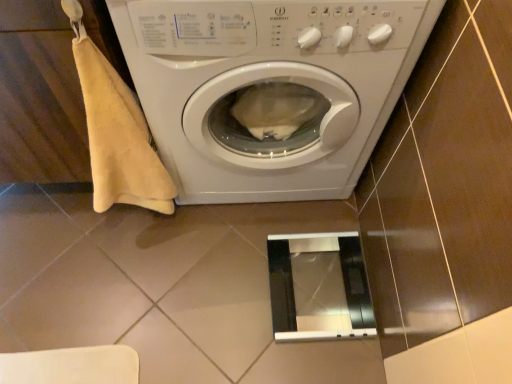
What do you see at coordinates (319, 287) in the screenshot?
I see `metallic silver screen door at lower center` at bounding box center [319, 287].

This screenshot has height=384, width=512. I want to click on metallic silver screen door at lower center, so click(319, 287).

Who is more distant, metallic silver screen door at lower center or white glossy washing machine at center?

metallic silver screen door at lower center is further from the camera.

Is white glossy washing machine at center inside metallic silver screen door at lower center?

Actually, white glossy washing machine at center is outside metallic silver screen door at lower center.

Between metallic silver screen door at lower center and white glossy washing machine at center, which one has smaller size?

metallic silver screen door at lower center.

Looking at their sizes, would you say metallic silver screen door at lower center is wider or thinner than white glossy washing machine at center?

Clearly, metallic silver screen door at lower center has less width compared to white glossy washing machine at center.

Could you tell me if metallic silver screen door at lower center is turned towards beige cotton towel at left?

No, metallic silver screen door at lower center is not facing towards beige cotton towel at left.

How far apart are metallic silver screen door at lower center and beige cotton towel at left?

21.45 inches.

How many degrees apart are the facing directions of metallic silver screen door at lower center and beige cotton towel at left?

There is a 0.22-degree angle between the facing directions of metallic silver screen door at lower center and beige cotton towel at left.

Are metallic silver screen door at lower center and beige cotton towel at left beside each other?

metallic silver screen door at lower center and beige cotton towel at left are not in contact.

Consider the image. Does white glossy washing machine at center have a lesser width compared to metallic silver screen door at lower center?

No.

Is white glossy washing machine at center bigger or smaller than metallic silver screen door at lower center?

Clearly, white glossy washing machine at center is larger in size than metallic silver screen door at lower center.

From the image's perspective, is white glossy washing machine at center beneath metallic silver screen door at lower center?

No, from the image's perspective, white glossy washing machine at center is not beneath metallic silver screen door at lower center.

Is point (420, 33) closer to viewer compared to point (278, 279)?

Yes, point (420, 33) is in front of point (278, 279).

How many degrees apart are the facing directions of white glossy washing machine at center and beige cotton towel at left?

1.44e-05 degrees.

Is white glossy washing machine at center at the left side of beige cotton towel at left?

No, white glossy washing machine at center is not to the left of beige cotton towel at left.

Who is more distant, white glossy washing machine at center or beige cotton towel at left?

white glossy washing machine at center is further away from the camera.

Is white glossy washing machine at center not near beige cotton towel at left?

No, there isn't a large distance between white glossy washing machine at center and beige cotton towel at left.

Between beige cotton towel at left and metallic silver screen door at lower center, which one has smaller width?

beige cotton towel at left.

Is beige cotton towel at left facing away from metallic silver screen door at lower center?

That's not correct — beige cotton towel at left is not looking away from metallic silver screen door at lower center.

How many degrees apart are the facing directions of beige cotton towel at left and white glossy washing machine at center?

There is a 1.44e-05-degree angle between the facing directions of beige cotton towel at left and white glossy washing machine at center.

Is beige cotton towel at left taller or shorter than white glossy washing machine at center?

Clearly, beige cotton towel at left is shorter compared to white glossy washing machine at center.

From a real-world perspective, is beige cotton towel at left physically above white glossy washing machine at center?

Indeed, from a real-world perspective, beige cotton towel at left stands above white glossy washing machine at center.

From the image's perspective, is beige cotton towel at left above white glossy washing machine at center?

Actually, beige cotton towel at left appears below white glossy washing machine at center in the image.

Locate an element on the screen. This screenshot has height=384, width=512. washing machine in front of the metallic silver screen door at lower center is located at coordinates (269, 89).

This screenshot has height=384, width=512. In the image, there is a beige cotton towel at left. In order to click on screen door below it (from the image's perspective) in this screenshot , I will do `click(319, 287)`.

Which object lies further to the anchor point beige cotton towel at left, white glossy washing machine at center or metallic silver screen door at lower center?

Based on the image, metallic silver screen door at lower center appears to be further to beige cotton towel at left.

From the image, which object appears to be nearer to metallic silver screen door at lower center, beige cotton towel at left or white glossy washing machine at center?

white glossy washing machine at center is closer to metallic silver screen door at lower center.

From the image, which object appears to be farther from white glossy washing machine at center, beige cotton towel at left or metallic silver screen door at lower center?

Among the two, metallic silver screen door at lower center is located further to white glossy washing machine at center.

Based on their spatial positions, is metallic silver screen door at lower center or beige cotton towel at left further from white glossy washing machine at center?

metallic silver screen door at lower center is positioned further to the anchor white glossy washing machine at center.

In the scene shown: From the image, which object appears to be nearer to metallic silver screen door at lower center, white glossy washing machine at center or beige cotton towel at left?

white glossy washing machine at center.

Which object lies further to the anchor point beige cotton towel at left, metallic silver screen door at lower center or white glossy washing machine at center?

metallic silver screen door at lower center lies further to beige cotton towel at left than the other object.

You are a GUI agent. You are given a task and a screenshot of the screen. Output one action in this format:
    pyautogui.click(x=<x>, y=<y>)
    Task: Click on the washing machine between beige cotton towel at left and metallic silver screen door at lower center along the z-axis
    The width and height of the screenshot is (512, 384).
    Given the screenshot: What is the action you would take?
    pyautogui.click(x=269, y=89)